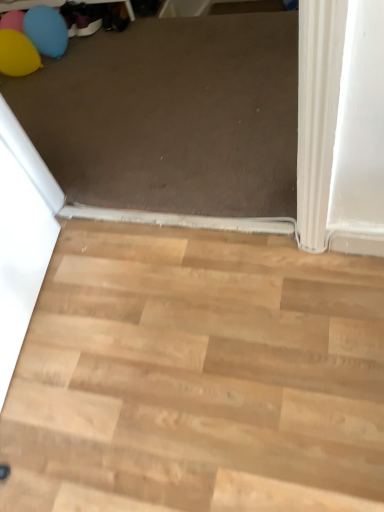
Question: Is light wood floor at lower right far from rubber balloon at upper left?

Choices:
 (A) no
 (B) yes

Answer: (B)

Question: Is light wood floor at lower right at the left side of rubber balloon at upper left?

Choices:
 (A) no
 (B) yes

Answer: (A)

Question: From the image's perspective, would you say light wood floor at lower right is shown under rubber balloon at upper left?

Choices:
 (A) yes
 (B) no

Answer: (A)

Question: Does light wood floor at lower right have a larger size compared to rubber balloon at upper left?

Choices:
 (A) no
 (B) yes

Answer: (B)

Question: Does light wood floor at lower right lie behind rubber balloon at upper left?

Choices:
 (A) no
 (B) yes

Answer: (A)

Question: Does light wood floor at lower right have a greater width compared to rubber balloon at upper left?

Choices:
 (A) no
 (B) yes

Answer: (B)

Question: Could you tell me if rubber balloon at upper left is turned towards light wood floor at lower right?

Choices:
 (A) no
 (B) yes

Answer: (A)

Question: Is there a large distance between rubber balloon at upper left and light wood floor at lower right?

Choices:
 (A) yes
 (B) no

Answer: (A)

Question: Does rubber balloon at upper left have a lesser height compared to light wood floor at lower right?

Choices:
 (A) no
 (B) yes

Answer: (A)

Question: From the image's perspective, is rubber balloon at upper left under light wood floor at lower right?

Choices:
 (A) yes
 (B) no

Answer: (B)

Question: Can you confirm if rubber balloon at upper left is bigger than light wood floor at lower right?

Choices:
 (A) yes
 (B) no

Answer: (B)

Question: Is light wood floor at lower right located within rubber balloon at upper left?

Choices:
 (A) yes
 (B) no

Answer: (B)

Question: Considering the positions of rubber balloon at upper left and light wood floor at lower right in the image, is rubber balloon at upper left taller or shorter than light wood floor at lower right?

Choices:
 (A) tall
 (B) short

Answer: (A)